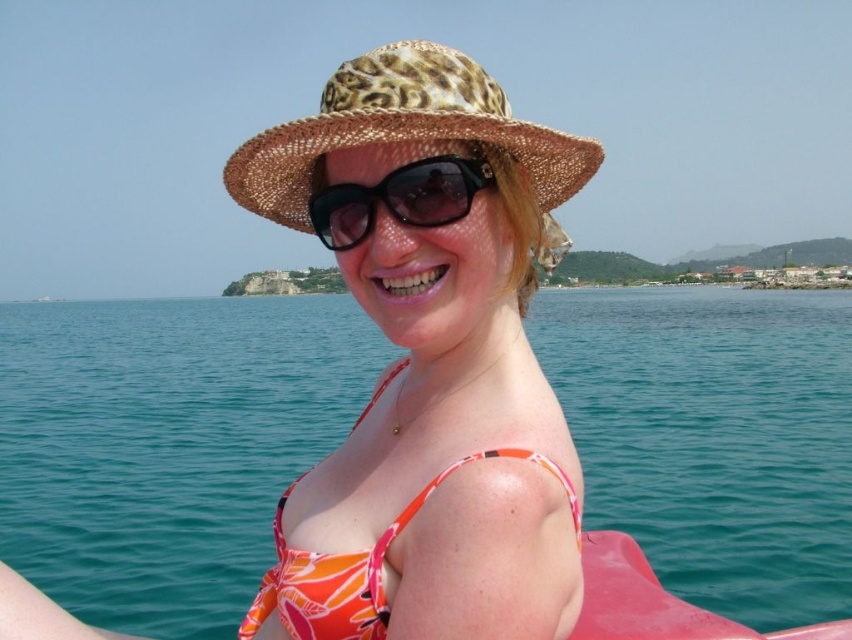
This screenshot has width=852, height=640. What do you see at coordinates (167, 445) in the screenshot? I see `blue water at center` at bounding box center [167, 445].

Does blue water at center come behind orange printed bikini top at center?

That is True.

Does point (157, 435) come farther from viewer compared to point (344, 618)?

That is True.

The image size is (852, 640). In order to click on blue water at center in this screenshot , I will do click(x=167, y=445).

Looking at this image, does leopard print straw hat at center have a lesser height compared to black matte sunglasses at center?

No, leopard print straw hat at center is not shorter than black matte sunglasses at center.

Which is behind, point (240, 148) or point (317, 216)?

Positioned behind is point (317, 216).

Where is `leopard print straw hat at center`? This screenshot has height=640, width=852. leopard print straw hat at center is located at coordinates (407, 134).

Does blue water at center appear under leopard print straw hat at center?

Yes, blue water at center is below leopard print straw hat at center.

Is blue water at center positioned at the back of leopard print straw hat at center?

Yes, blue water at center is further from the viewer.

Which is behind, point (570, 371) or point (376, 67)?

Positioned behind is point (570, 371).

I want to click on blue water at center, so click(x=167, y=445).